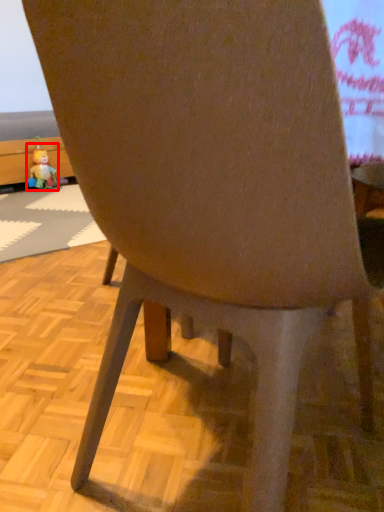
Question: From the image's perspective, where is toy (annotated by the red box) located relative to place mat?

Choices:
 (A) above
 (B) below

Answer: (A)